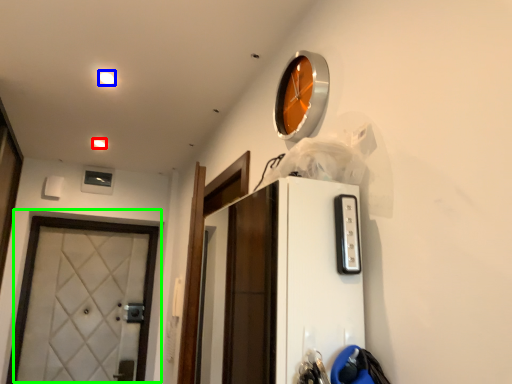
Question: Which object is the farthest from light (highlighted by a red box)? Choose among these: light (highlighted by a blue box) or door (highlighted by a green box).

Choices:
 (A) light
 (B) door

Answer: (B)